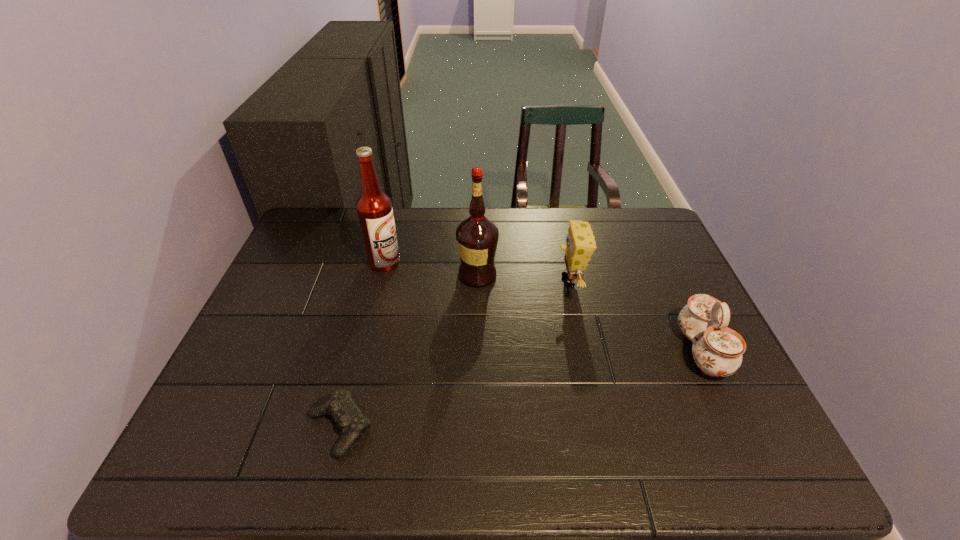
Where is `the left alcohol`? The width and height of the screenshot is (960, 540). the left alcohol is located at coordinates (374, 209).

At what (x,y) coordinates should I click in order to perform the action: click on the right alcohol. Please return your answer as a coordinate pair (x, y). Looking at the image, I should click on (477, 237).

Find the location of a particular element. The width and height of the screenshot is (960, 540). sponge is located at coordinates (580, 244).

The height and width of the screenshot is (540, 960). I want to click on chinaware, so click(x=717, y=350).

Where is `the rightmost object`? This screenshot has width=960, height=540. the rightmost object is located at coordinates (717, 350).

Where is `the shortest object`? the shortest object is located at coordinates tap(339, 404).

Image resolution: width=960 pixels, height=540 pixels. Find the location of `control`. control is located at coordinates (339, 404).

Find the location of `vacant space situated on the label side of the left alcohol`. vacant space situated on the label side of the left alcohol is located at coordinates (532, 262).

At what (x,y) coordinates should I click in order to perform the action: click on vacant space situated 0.190m on the label of the right alcohol. Please return your answer as a coordinate pair (x, y). Looking at the image, I should click on (562, 275).

Find the location of a particular element. free space located on the face of the second object from right to left is located at coordinates (524, 281).